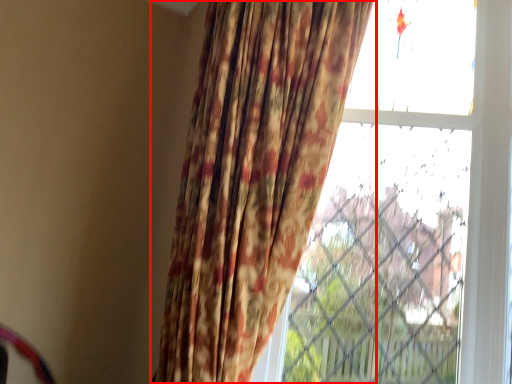
Question: From the image's perspective, what is the correct spatial relationship of curtain (annotated by the red box) in relation to window?

Choices:
 (A) above
 (B) below

Answer: (A)